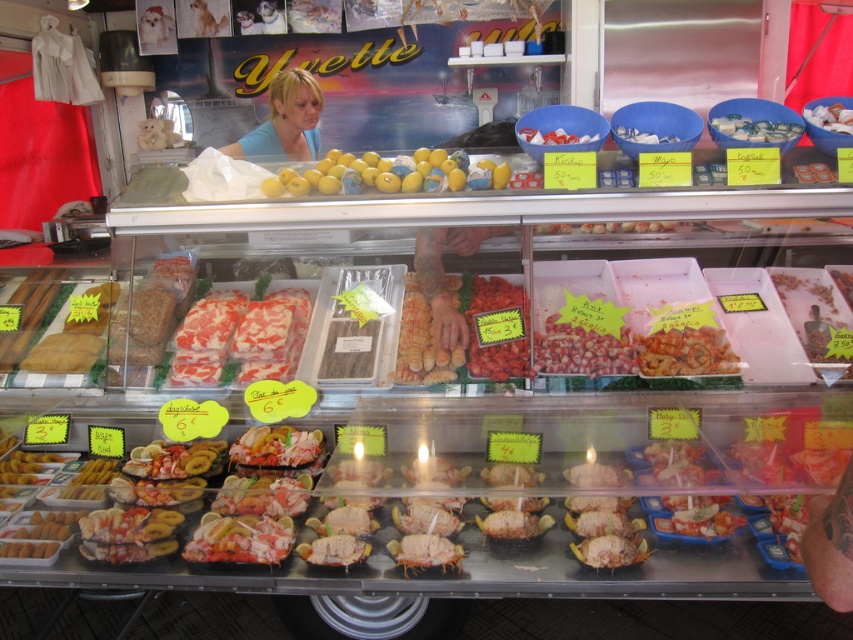
Question: Among these objects, which one is farthest from the camera?

Choices:
 (A) white plastic bowl at center
 (B) pinkish-orange shell at center

Answer: (A)

Question: Is marbled pink and white meat at center in front of shiny silver seafood at center?

Choices:
 (A) yes
 (B) no

Answer: (B)

Question: Does pinkish matte dried shrimp at center have a lesser width compared to shiny lobster at center?

Choices:
 (A) no
 (B) yes

Answer: (A)

Question: Where is marbled pink and white meat at center located in relation to pinkish-orange shell at center in the image?

Choices:
 (A) above
 (B) below

Answer: (A)

Question: Which of these objects is positioned closest to the white glossy seafood at center?

Choices:
 (A) white crumbly ice at upper center
 (B) yellow matte olives at center
 (C) white plastic bowl at center

Answer: (B)

Question: Among these points, which one is farthest from the camera?

Choices:
 (A) (532, 349)
 (B) (210, 442)

Answer: (A)